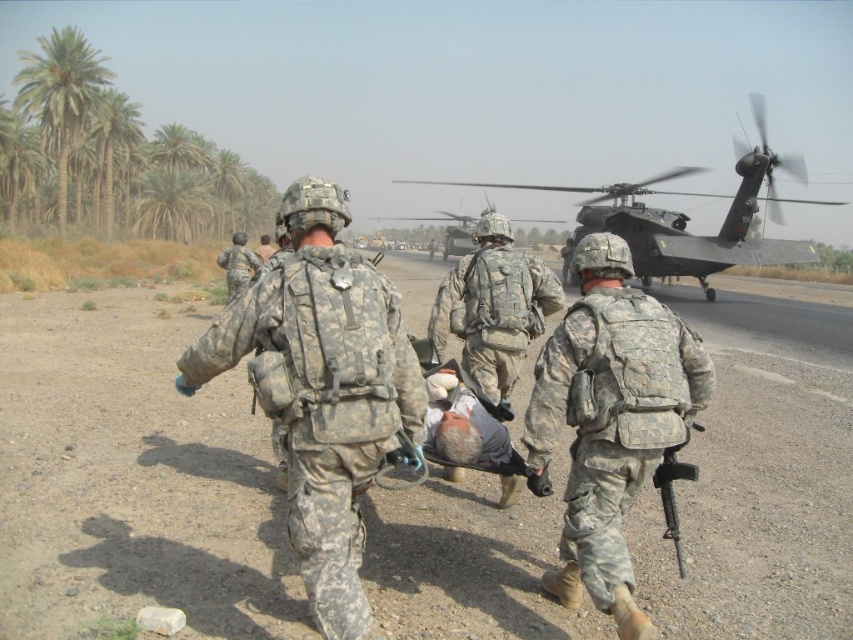
Question: Estimate the real-world distances between objects in this image. Which object is farther from the camouflage fabric soldier at center?

Choices:
 (A) camouflage uniform at center
 (B) green leafy palm trees at left

Answer: (B)

Question: Is green leafy palm trees at left thinner than camouflage fabric soldier at center?

Choices:
 (A) no
 (B) yes

Answer: (A)

Question: Can you confirm if camouflage fabric backpack at center is positioned below green leafy palm trees at left?

Choices:
 (A) no
 (B) yes

Answer: (B)

Question: Which point appears farthest from the camera in this image?

Choices:
 (A) (643, 467)
 (B) (27, 96)
 (C) (103, 209)
 (D) (524, 344)

Answer: (C)

Question: Which of the following is the farthest from the observer?

Choices:
 (A) camouflage fabric soldier at center
 (B) dark gray matte helicopter at center

Answer: (B)

Question: Can you confirm if camouflage fabric backpack at center is positioned to the right of green leafy palm trees at left?

Choices:
 (A) no
 (B) yes

Answer: (B)